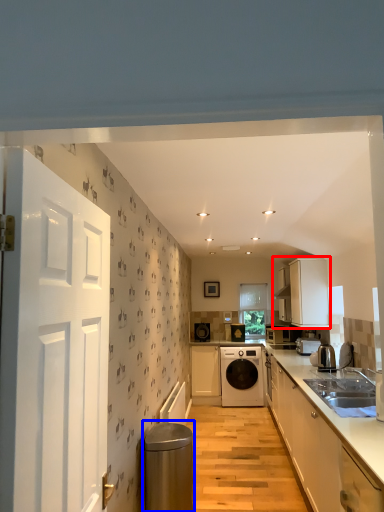
Question: Which object appears closest to the camera in this image, cabinetry (highlighted by a red box) or water heater (highlighted by a blue box)?

Choices:
 (A) cabinetry
 (B) water heater

Answer: (B)